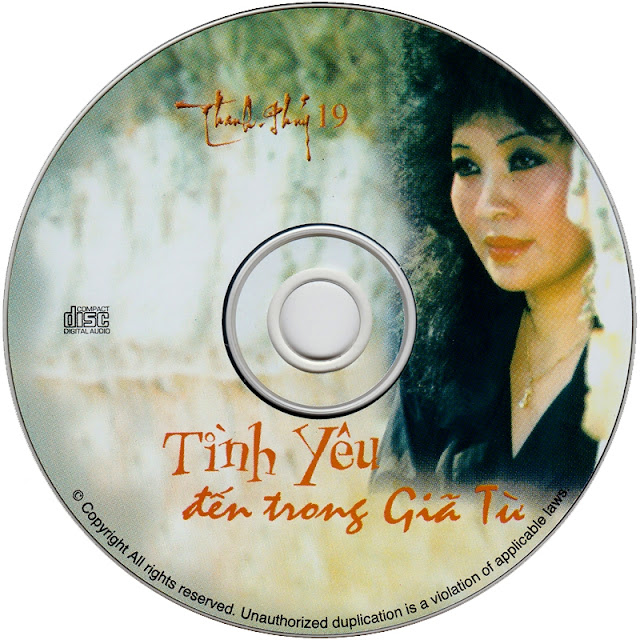
This screenshot has height=640, width=640. Find the location of `cd`. cd is located at coordinates (256, 294).